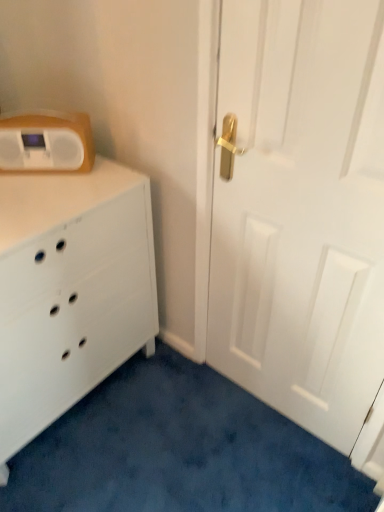
Question: Are white matte door at right and white matte chest of drawers at left far apart?

Choices:
 (A) yes
 (B) no

Answer: (B)

Question: Is the position of white matte door at right more distant than that of white matte chest of drawers at left?

Choices:
 (A) yes
 (B) no

Answer: (B)

Question: Can you confirm if white matte door at right is thinner than white matte chest of drawers at left?

Choices:
 (A) no
 (B) yes

Answer: (B)

Question: Can you confirm if white matte door at right is positioned to the right of white matte chest of drawers at left?

Choices:
 (A) yes
 (B) no

Answer: (A)

Question: From a real-world perspective, is white matte door at right beneath white matte chest of drawers at left?

Choices:
 (A) yes
 (B) no

Answer: (B)

Question: Is white matte door at right to the left of white matte chest of drawers at left from the viewer's perspective?

Choices:
 (A) no
 (B) yes

Answer: (A)

Question: Is matte white radio at upper left surrounded by white matte chest of drawers at left?

Choices:
 (A) no
 (B) yes

Answer: (A)

Question: Considering the relative sizes of white matte chest of drawers at left and matte white radio at upper left in the image provided, is white matte chest of drawers at left thinner than matte white radio at upper left?

Choices:
 (A) yes
 (B) no

Answer: (B)

Question: Is white matte chest of drawers at left facing away from matte white radio at upper left?

Choices:
 (A) yes
 (B) no

Answer: (B)

Question: Is white matte chest of drawers at left smaller than matte white radio at upper left?

Choices:
 (A) no
 (B) yes

Answer: (A)

Question: Does white matte chest of drawers at left lie in front of matte white radio at upper left?

Choices:
 (A) yes
 (B) no

Answer: (A)

Question: From the image's perspective, is white matte chest of drawers at left under matte white radio at upper left?

Choices:
 (A) yes
 (B) no

Answer: (A)

Question: Does matte white radio at upper left come behind white matte door at right?

Choices:
 (A) yes
 (B) no

Answer: (A)